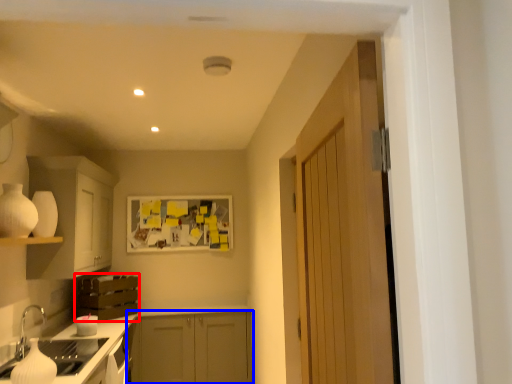
Question: Among these objects, which one is nearest to the camera, cabinetry (highlighted by a red box) or cabinetry (highlighted by a blue box)?

Choices:
 (A) cabinetry
 (B) cabinetry

Answer: (A)